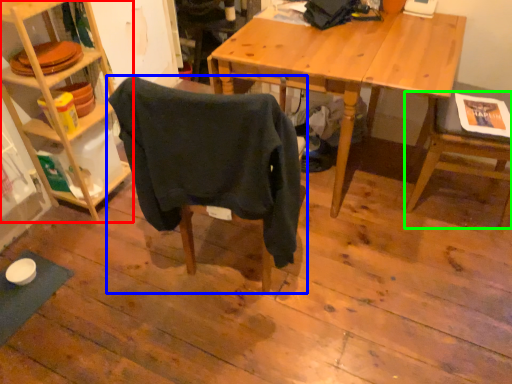
Question: Which is nearer to the shelf (highlighted by a red box)? chair (highlighted by a blue box) or chair (highlighted by a green box).

Choices:
 (A) chair
 (B) chair

Answer: (A)